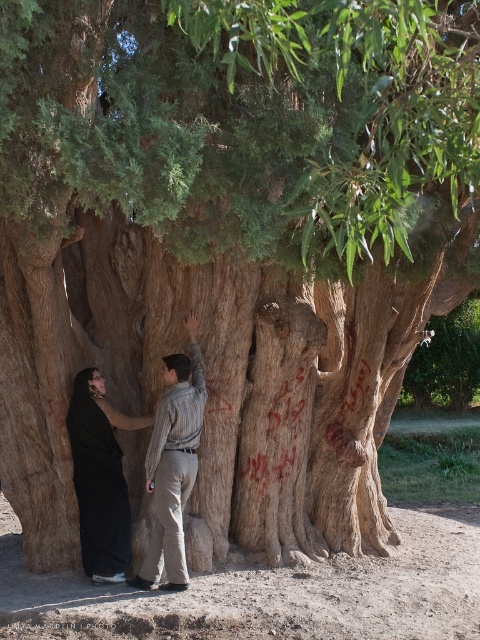
Is point (160, 500) behind point (86, 428)?

No, it is not.

Find the location of a particular element. This screenshot has width=480, height=640. striped shirt at center is located at coordinates (173, 464).

The height and width of the screenshot is (640, 480). I want to click on striped shirt at center, so point(173,464).